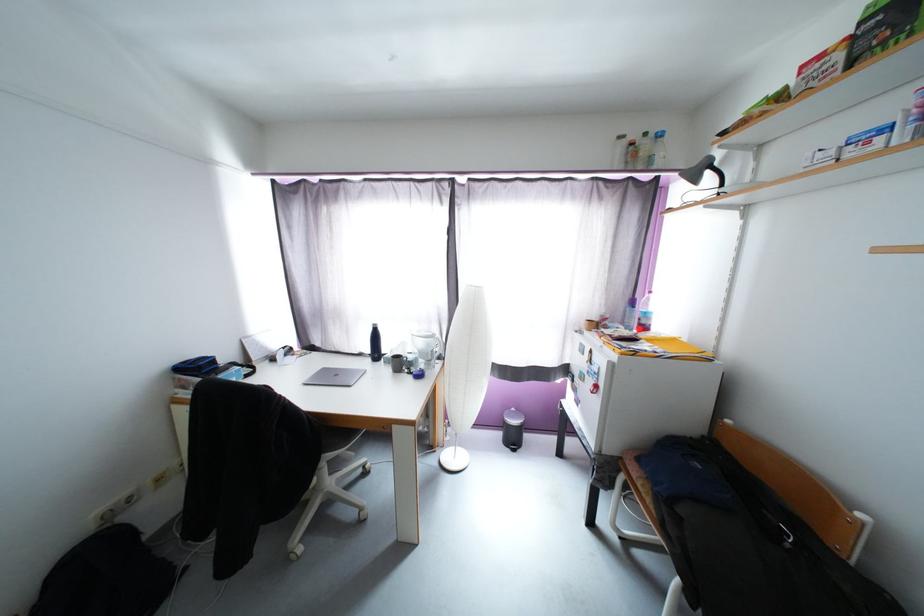
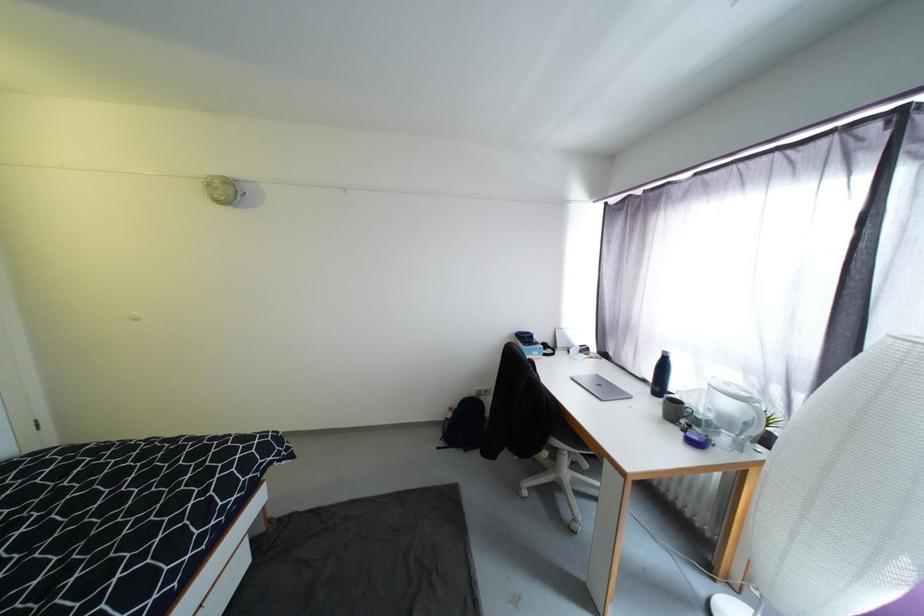
Question: The camera is either moving clockwise (left) or counter-clockwise (right) around the object. The first image is from the beginning of the video and the second image is from the end. Is the camera moving left or right when shooting the video?

Choices:
 (A) Left
 (B) Right

Answer: (B)